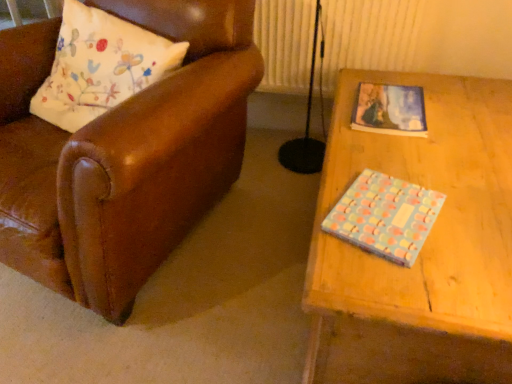
Question: Considering the positions of pastel polka dot book at right, the first book positioned from the bottom, and pastel-patterned paper at upper right, the 2th book in the front-to-back sequence, in the image, is pastel polka dot book at right, the first book positioned from the bottom, bigger or smaller than pastel-patterned paper at upper right, the 2th book in the front-to-back sequence,?

Choices:
 (A) small
 (B) big

Answer: (A)

Question: From a real-world perspective, is pastel polka dot book at right, the first book positioned from the bottom, physically located above or below pastel-patterned paper at upper right, the 2th book in the front-to-back sequence?

Choices:
 (A) above
 (B) below

Answer: (A)

Question: Based on their relative distances, which object is nearer to the leather pillow at left?

Choices:
 (A) pastel polka dot book at right, positioned as the first book in front-to-back order
 (B) pastel-patterned paper at upper right, which is counted as the 1th book, starting from the top

Answer: (B)

Question: Estimate the real-world distances between objects in this image. Which object is farther from the leather pillow at left?

Choices:
 (A) pastel-patterned paper at upper right, arranged as the 1th book when viewed from the back
 (B) pastel polka dot book at right, which is the second book from top to bottom

Answer: (B)